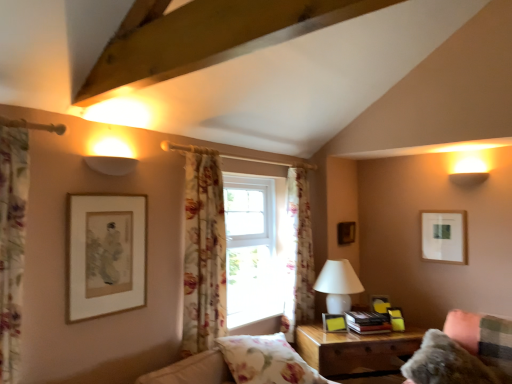
Question: In terms of width, does floral fabric pillow at lower center look wider or thinner when compared to matte yellow picture frame at right, positioned as the 2th picture frame in left-to-right order?

Choices:
 (A) thin
 (B) wide

Answer: (B)

Question: Do you think floral fabric pillow at lower center is within matte yellow picture frame at right, positioned as the 2th picture frame in left-to-right order, or outside of it?

Choices:
 (A) inside
 (B) outside

Answer: (B)

Question: Estimate the real-world distances between objects in this image. Which object is closer to the matte yellow picture frame at right, which is the second picture frame from front to back?

Choices:
 (A) white glossy table lamp at center right
 (B) floral fabric curtain at center, placed as the second curtain when sorted from front to back
 (C) white wooden window at center
 (D) floral fabric pillow at lower center
 (E) fuzzy fabric couch at lower right

Answer: (A)

Question: Which object is positioned closest to the white glossy table lamp at center right?

Choices:
 (A) wooden nightstand at lower right
 (B) matte gold picture frame at lower right, acting as the 5th picture frame starting from the left
 (C) white wooden window at center
 (D) matte gold picture frame at left, placed as the first picture frame when sorted from front to back
 (E) white matte picture frame at upper right, the first picture frame in the right-to-left sequence

Answer: (A)